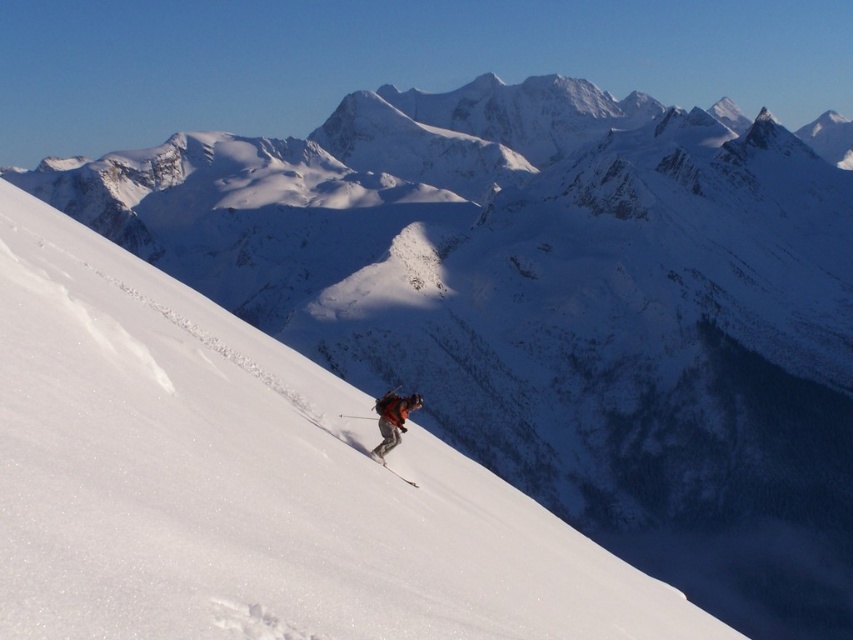
Question: Does white snow ski slope at center have a larger size compared to matte black ski at center?

Choices:
 (A) no
 (B) yes

Answer: (B)

Question: Can you confirm if white snow ski slope at center is positioned below matte black ski at center?

Choices:
 (A) yes
 (B) no

Answer: (B)

Question: Which object is closer to the camera taking this photo?

Choices:
 (A) white snow ski slope at center
 (B) orange fabric jacket at center

Answer: (A)

Question: Which of the following is the farthest from the observer?

Choices:
 (A) white snow ski slope at center
 (B) orange fabric jacket at center

Answer: (B)

Question: Is white snow ski slope at center to the right of orange fabric jacket at center from the viewer's perspective?

Choices:
 (A) no
 (B) yes

Answer: (A)

Question: Among these objects, which one is farthest from the camera?

Choices:
 (A) orange fabric jacket at center
 (B) matte black ski at center

Answer: (A)